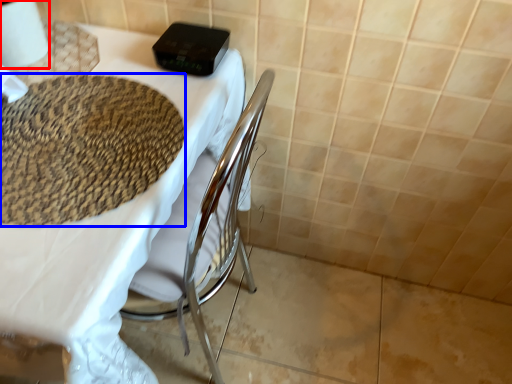
Question: Among these objects, which one is farthest to the camera, toilet paper (highlighted by a red box) or mat (highlighted by a blue box)?

Choices:
 (A) toilet paper
 (B) mat

Answer: (A)